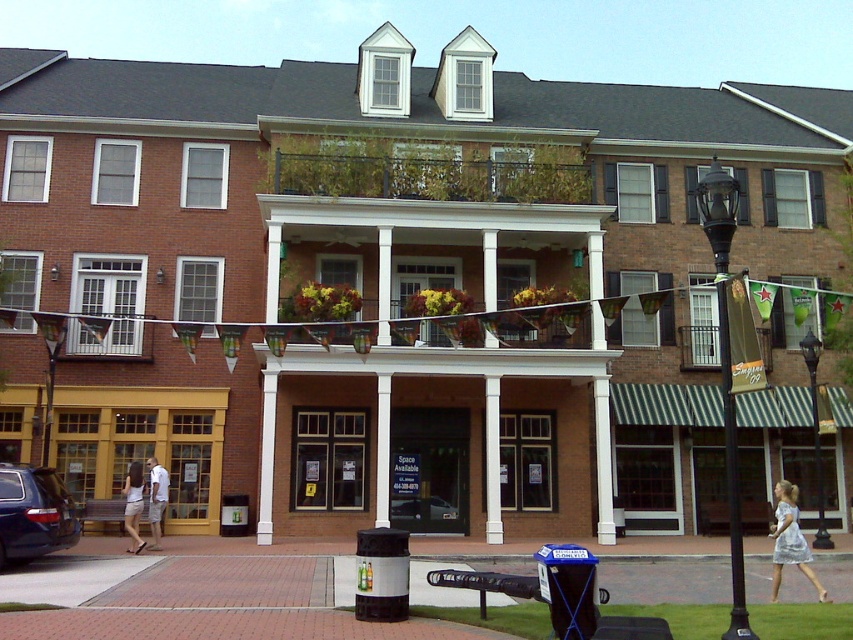
Which of these two, matte black suv at lower left or white cotton dress at center, stands shorter?

matte black suv at lower left

Does matte black suv at lower left appear on the right side of white cotton dress at center?

No, matte black suv at lower left is not to the right of white cotton dress at center.

Is point (4, 468) less distant than point (126, 529)?

Yes, it is.

At what (x,y) coordinates should I click in order to perform the action: click on matte black suv at lower left. Please return your answer as a coordinate pair (x, y). This screenshot has height=640, width=853. Looking at the image, I should click on (33, 513).

Between black polished metal streetlamp at center right and black metal lamp post at center, which one is positioned higher?

Positioned higher is black polished metal streetlamp at center right.

Identify the location of black polished metal streetlamp at center right. This screenshot has width=853, height=640. 726,369.

You are a GUI agent. You are given a task and a screenshot of the screen. Output one action in this format:
    pyautogui.click(x=<x>, y=<y>)
    Task: Click on the black polished metal streetlamp at center right
    Image resolution: width=853 pixels, height=640 pixels.
    Given the screenshot: What is the action you would take?
    pyautogui.click(x=726, y=369)

Can you confirm if metallic silver car at center is bigger than white cotton dress at center?

Actually, metallic silver car at center might be smaller than white cotton dress at center.

This screenshot has width=853, height=640. I want to click on metallic silver car at center, so click(x=422, y=508).

Find the location of `metallic silver car at center`. metallic silver car at center is located at coordinates (422, 508).